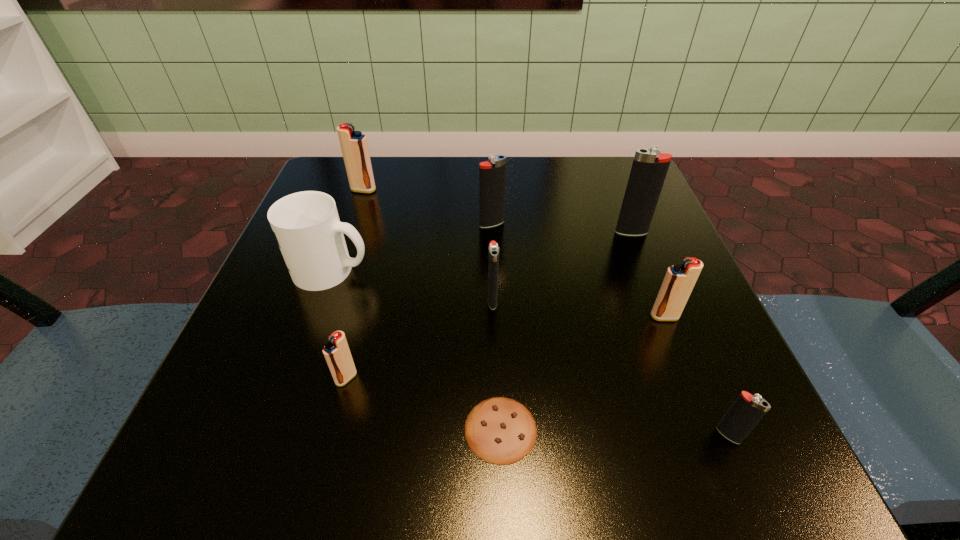
This screenshot has height=540, width=960. I want to click on mug located in the left edge section of the desktop, so click(x=306, y=225).

Image resolution: width=960 pixels, height=540 pixels. Identify the location of object located at the far left corner. (354, 146).

You are a GUI agent. You are given a task and a screenshot of the screen. Output one action in this format:
    pyautogui.click(x=<x>, y=<y>)
    Task: Click on the object at the near right corner
    The height and width of the screenshot is (540, 960).
    Given the screenshot: What is the action you would take?
    pyautogui.click(x=747, y=410)

Find the location of a particular element. The image size is (960, 540). free space at the far edge of the desktop is located at coordinates (447, 211).

In the image, there is a desktop. What are the coordinates of `vacant space at the near edge` in the screenshot? It's located at (331, 420).

Locate an element on the screen. free space at the left edge of the desktop is located at coordinates (251, 369).

In the image, there is a desktop. Where is `vacant space at the right edge`? The height and width of the screenshot is (540, 960). vacant space at the right edge is located at coordinates (711, 316).

In the image, there is a desktop. At what (x,y) coordinates should I click in order to perform the action: click on vacant space at the far left corner. Please return your answer as a coordinate pair (x, y). Image resolution: width=960 pixels, height=540 pixels. Looking at the image, I should click on (387, 187).

Find the location of a particular element. This screenshot has height=540, width=960. free region at the far right corner is located at coordinates (618, 195).

This screenshot has width=960, height=540. I want to click on unoccupied area between the shortest object and the seventh farthest object, so click(423, 404).